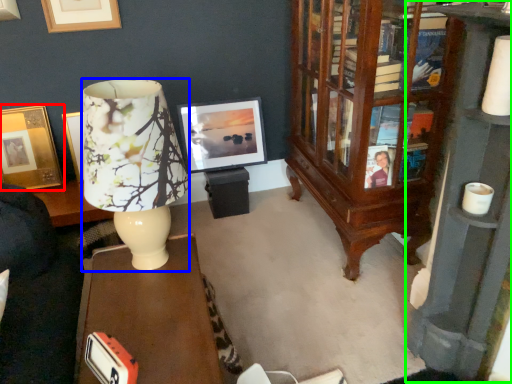
Question: Which object is positioned closest to picture frame (highlighted by a red box)? Select from lamp (highlighted by a blue box) and bookcase (highlighted by a green box).

Choices:
 (A) lamp
 (B) bookcase

Answer: (A)